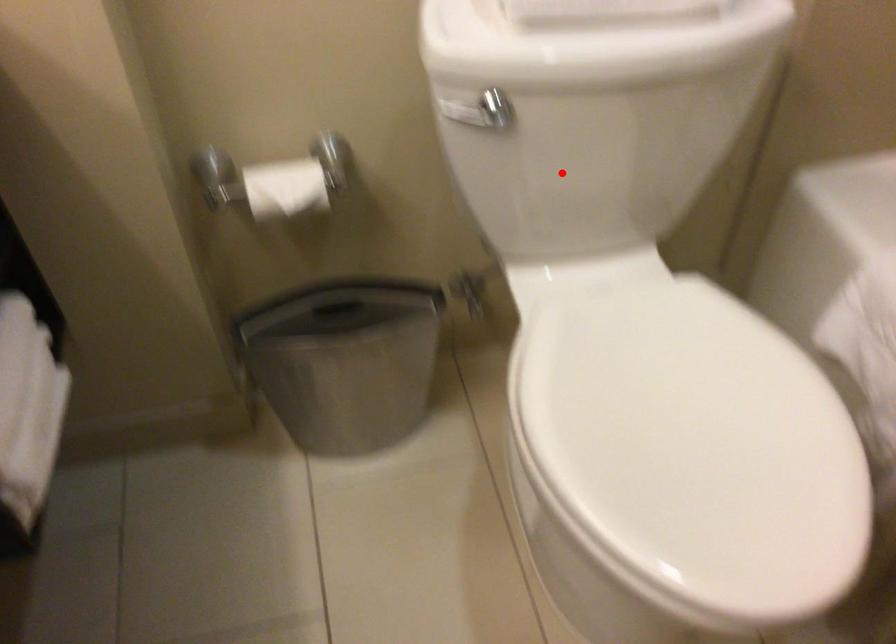
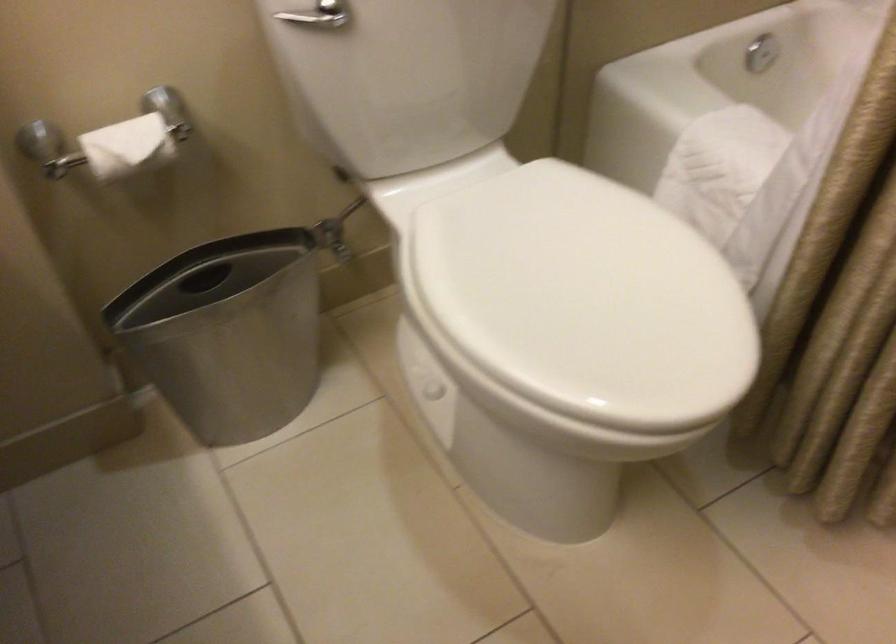
Locate, in the second image, the point that corresponds to the highlighted location in the first image.

(407, 77)